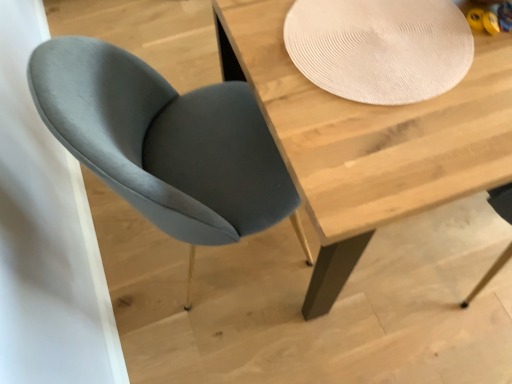
Question: Considering the relative sizes of velvet grey chair at left and wooden table at center in the image provided, is velvet grey chair at left shorter than wooden table at center?

Choices:
 (A) yes
 (B) no

Answer: (B)

Question: Considering the relative sizes of velvet grey chair at left and wooden table at center in the image provided, is velvet grey chair at left smaller than wooden table at center?

Choices:
 (A) no
 (B) yes

Answer: (B)

Question: Is velvet grey chair at left next to wooden table at center and touching it?

Choices:
 (A) no
 (B) yes

Answer: (A)

Question: From a real-world perspective, is velvet grey chair at left located beneath wooden table at center?

Choices:
 (A) yes
 (B) no

Answer: (B)

Question: Is velvet grey chair at left positioned in front of wooden table at center?

Choices:
 (A) yes
 (B) no

Answer: (A)

Question: Considering the positions of point (241, 114) and point (475, 140), is point (241, 114) closer or farther from the camera than point (475, 140)?

Choices:
 (A) farther
 (B) closer

Answer: (A)

Question: From a real-world perspective, is velvet grey chair at left positioned above or below wooden table at center?

Choices:
 (A) below
 (B) above

Answer: (B)

Question: Relative to wooden table at center, is velvet grey chair at left in front or behind?

Choices:
 (A) front
 (B) behind

Answer: (A)

Question: From the image's perspective, is velvet grey chair at left positioned above or below wooden table at center?

Choices:
 (A) above
 (B) below

Answer: (B)

Question: Looking at the image, does wooden table at center seem bigger or smaller compared to velvet grey chair at left?

Choices:
 (A) big
 (B) small

Answer: (A)

Question: In the image, is wooden table at center on the left side or the right side of velvet grey chair at left?

Choices:
 (A) left
 (B) right

Answer: (B)

Question: Considering the positions of wooden table at center and velvet grey chair at left in the image, is wooden table at center wider or thinner than velvet grey chair at left?

Choices:
 (A) wide
 (B) thin

Answer: (A)

Question: Is point (409, 167) closer or farther from the camera than point (140, 125)?

Choices:
 (A) closer
 (B) farther

Answer: (A)

Question: Is wooden table at center wider or thinner than beige textured placemat at upper center?

Choices:
 (A) thin
 (B) wide

Answer: (B)

Question: Considering the positions of wooden table at center and beige textured placemat at upper center in the image, is wooden table at center bigger or smaller than beige textured placemat at upper center?

Choices:
 (A) small
 (B) big

Answer: (B)